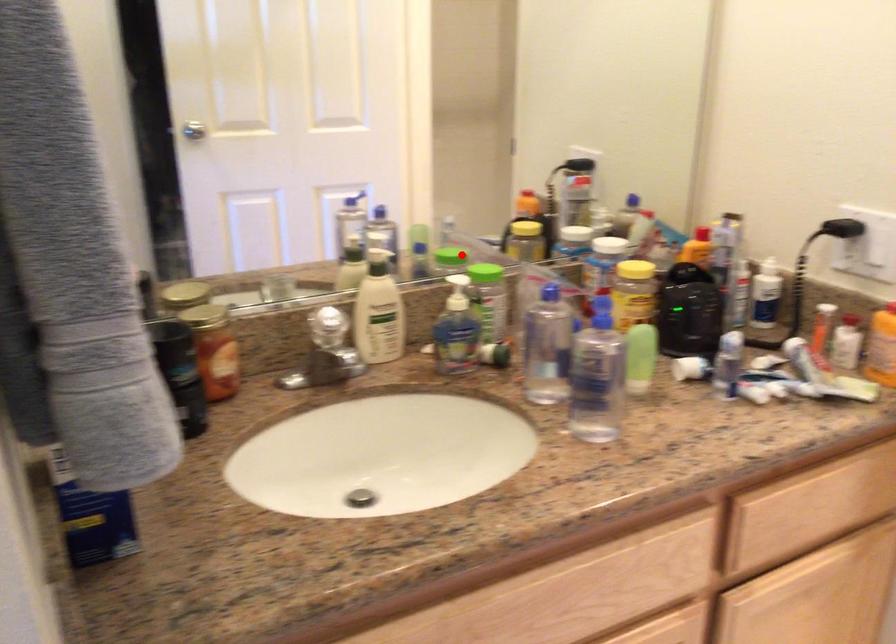
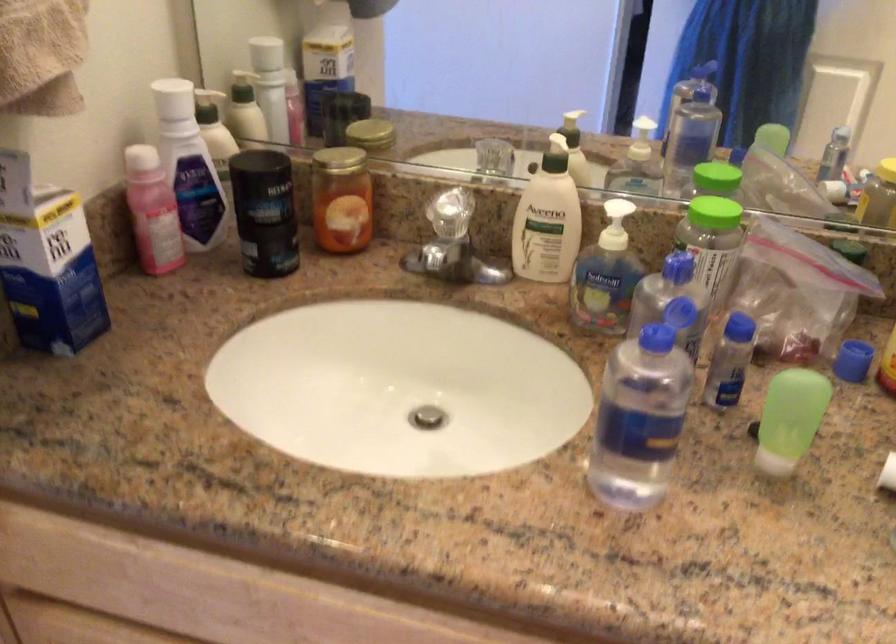
Question: A red point is marked in image1. In image2, is the corresponding 3D point closer to the camera or farther? Reply with the corresponding letter.

Choices:
 (A) The corresponding 3D point is closer.
 (B) The corresponding 3D point is farther.

Answer: (A)